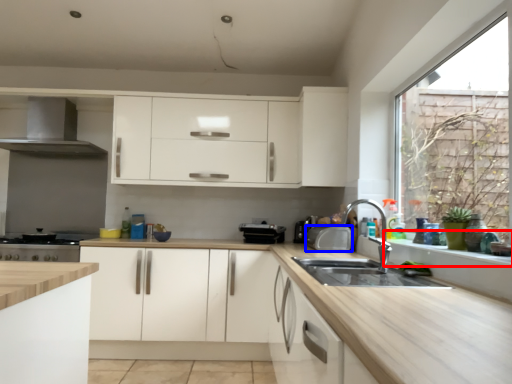
Question: Which point is closer to the camera, window sill (highlighted by a red box) or appliance (highlighted by a blue box)?

Choices:
 (A) window sill
 (B) appliance

Answer: (A)